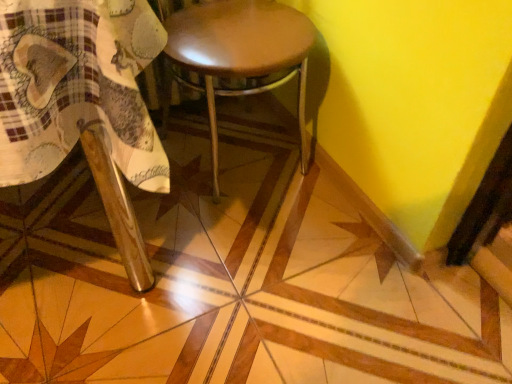
Question: Is wooden chair at lower left bigger or smaller than shiny brown stool at center?

Choices:
 (A) small
 (B) big

Answer: (B)

Question: Would you say wooden chair at lower left is to the left or to the right of shiny brown stool at center in the picture?

Choices:
 (A) left
 (B) right

Answer: (A)

Question: From a real-world perspective, is wooden chair at lower left above or below shiny brown stool at center?

Choices:
 (A) above
 (B) below

Answer: (A)

Question: From a real-world perspective, is shiny brown stool at center above or below wooden chair at lower left?

Choices:
 (A) below
 (B) above

Answer: (A)

Question: From the image's perspective, is shiny brown stool at center above or below wooden chair at lower left?

Choices:
 (A) above
 (B) below

Answer: (A)

Question: Do you think shiny brown stool at center is within wooden chair at lower left, or outside of it?

Choices:
 (A) outside
 (B) inside

Answer: (A)

Question: In terms of width, does shiny brown stool at center look wider or thinner when compared to wooden chair at lower left?

Choices:
 (A) thin
 (B) wide

Answer: (A)